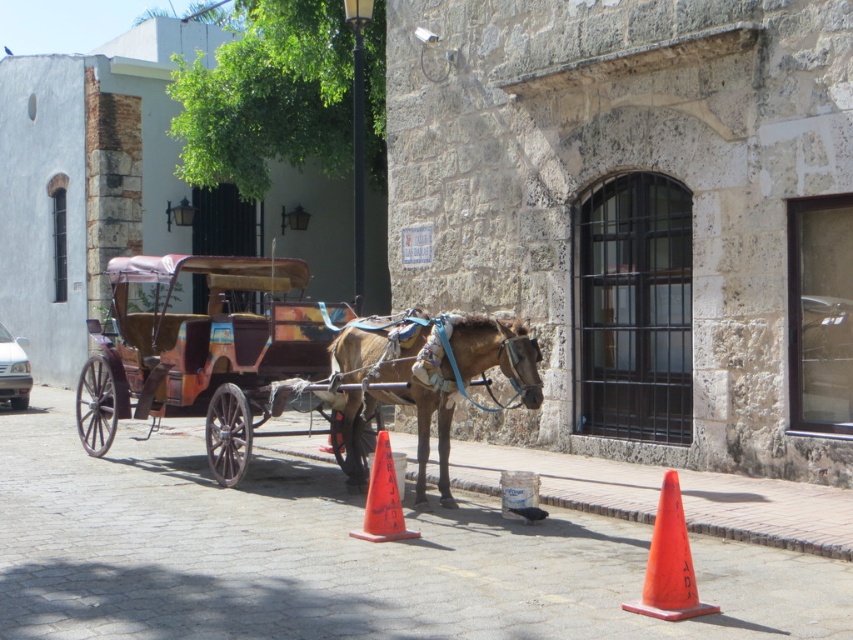
Question: Which object appears closest to the camera in this image?

Choices:
 (A) orange plastic traffic cone at lower right
 (B) wooden polished cart at center

Answer: (A)

Question: Does brown leather horse at center have a lesser width compared to orange plastic traffic cone at lower right?

Choices:
 (A) yes
 (B) no

Answer: (B)

Question: Can you confirm if wooden polished cart at center is positioned to the left of orange plastic traffic cone at lower right?

Choices:
 (A) yes
 (B) no

Answer: (A)

Question: Where is wooden polished cart at center located in relation to orange plastic traffic cone at lower right in the image?

Choices:
 (A) above
 (B) below

Answer: (A)

Question: Which object appears closest to the camera in this image?

Choices:
 (A) orange plastic cone at lower center
 (B) wooden polished cart at center

Answer: (A)

Question: Which of the following is the closest to the observer?

Choices:
 (A) (390, 385)
 (B) (520, 324)

Answer: (B)